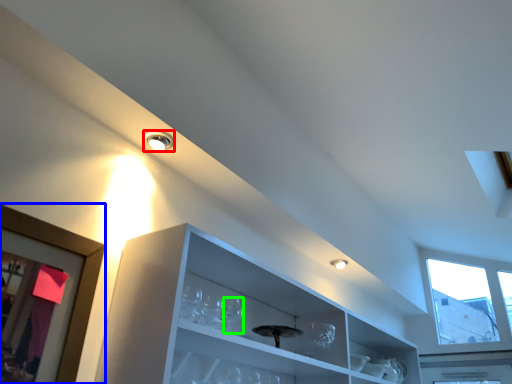
Question: Which is farther away from droplight (highlighted by a red box)? picture frame (highlighted by a blue box) or wine glass (highlighted by a green box)?

Choices:
 (A) picture frame
 (B) wine glass

Answer: (B)